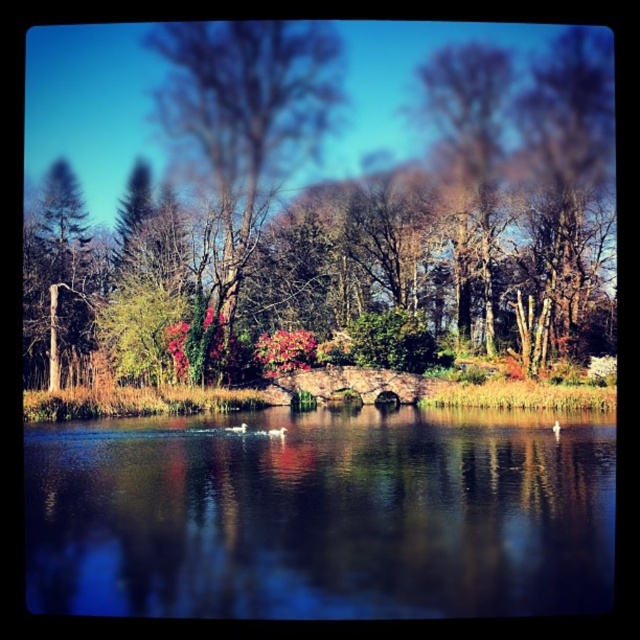
Does transparent water at center have a lesser width compared to green matte tree at left?

Incorrect, transparent water at center's width is not less than green matte tree at left's.

Can you confirm if transparent water at center is positioned to the left of green matte tree at left?

No, transparent water at center is not to the left of green matte tree at left.

This screenshot has width=640, height=640. What do you see at coordinates (321, 516) in the screenshot? I see `transparent water at center` at bounding box center [321, 516].

Where is `transparent water at center`? The width and height of the screenshot is (640, 640). transparent water at center is located at coordinates (321, 516).

Can you confirm if transparent water at center is shorter than smooth bark tree at center?

Yes, transparent water at center is shorter than smooth bark tree at center.

Is point (125, 557) farther from viewer compared to point (195, 96)?

No, it is in front of (195, 96).

Locate an element on the screen. The height and width of the screenshot is (640, 640). transparent water at center is located at coordinates (321, 516).

Can you confirm if green leafy tree at center is smaller than smooth bark tree at center?

No, green leafy tree at center is not smaller than smooth bark tree at center.

Image resolution: width=640 pixels, height=640 pixels. I want to click on green leafy tree at center, so click(x=342, y=140).

This screenshot has height=640, width=640. In order to click on green leafy tree at center in this screenshot , I will do `click(342, 140)`.